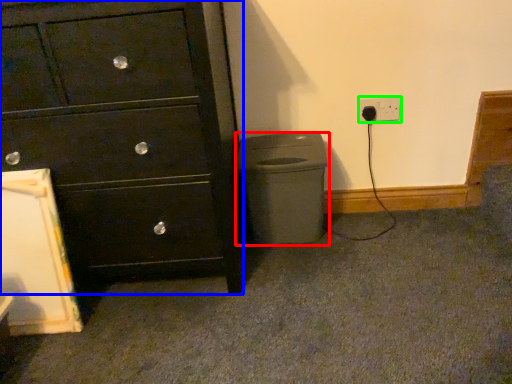
Question: Which object is positioned farthest from waste container (highlighted by a red box)? Select from chest of drawers (highlighted by a blue box) and power plugs and sockets (highlighted by a green box).

Choices:
 (A) chest of drawers
 (B) power plugs and sockets

Answer: (B)